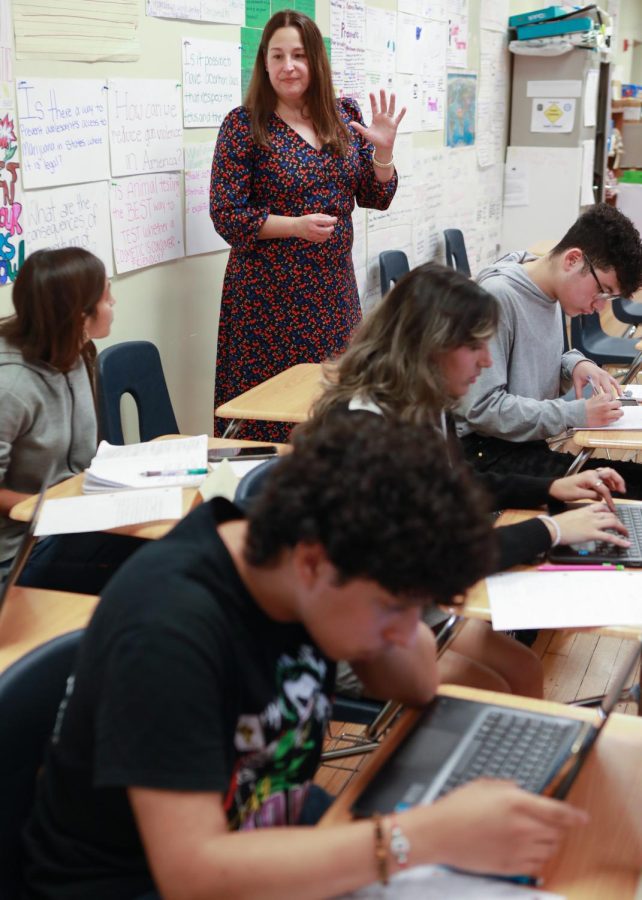
The height and width of the screenshot is (900, 642). Find the location of `chairs`. chairs is located at coordinates (27, 734), (122, 371), (390, 262), (453, 247), (629, 307), (599, 343).